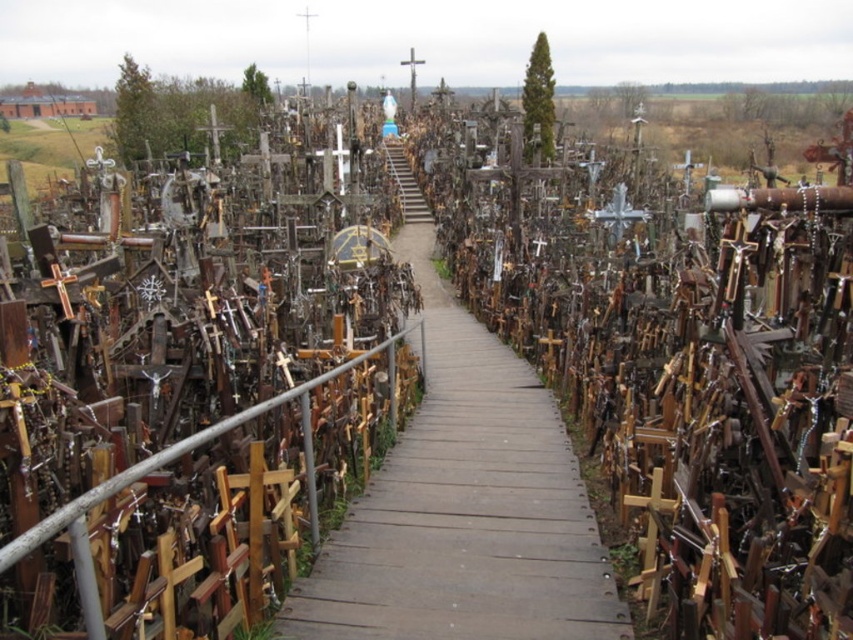
You are a visitor standing at the entrance of the Hill of Crosses. You see the wooden walkway at center and the metallic cross at left. Which object is taller?

The wooden walkway at center is much taller than the metallic cross at left.

You are a visitor at the Hill of Crosses and want to take a photo of the wooden walkway at center without the metallic cross at left blocking the view. Is there a way to do this?

The wooden walkway at center is positioned under the metallic cross at left, so you can move to a position where the metallic cross at left is behind the walkway or adjust your angle to exclude it from the frame.

You are a visitor at the Hill of Crosses and want to take a photo of the wooden walkway at center and the metallic cross at left. Which object should you focus on first if you want to capture both in a single frame without moving your camera? Explain your reasoning based on their sizes.

The wooden walkway at center is bigger than the metallic cross at left. To capture both in a single frame without moving the camera, focus on the wooden walkway at center first since it occupies more space and will be easier to frame, allowing the smaller metallic cross at left to fit within the same shot.